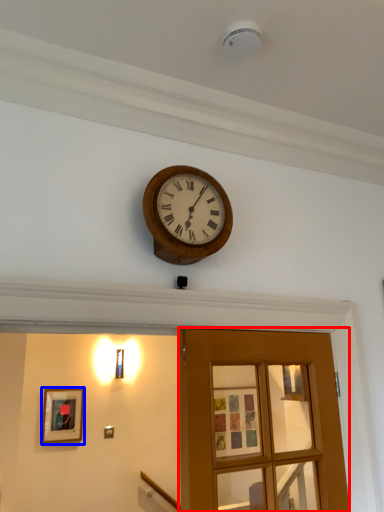
Question: Which object appears farthest to the camera in this image, door (highlighted by a red box) or picture frame (highlighted by a blue box)?

Choices:
 (A) door
 (B) picture frame

Answer: (B)